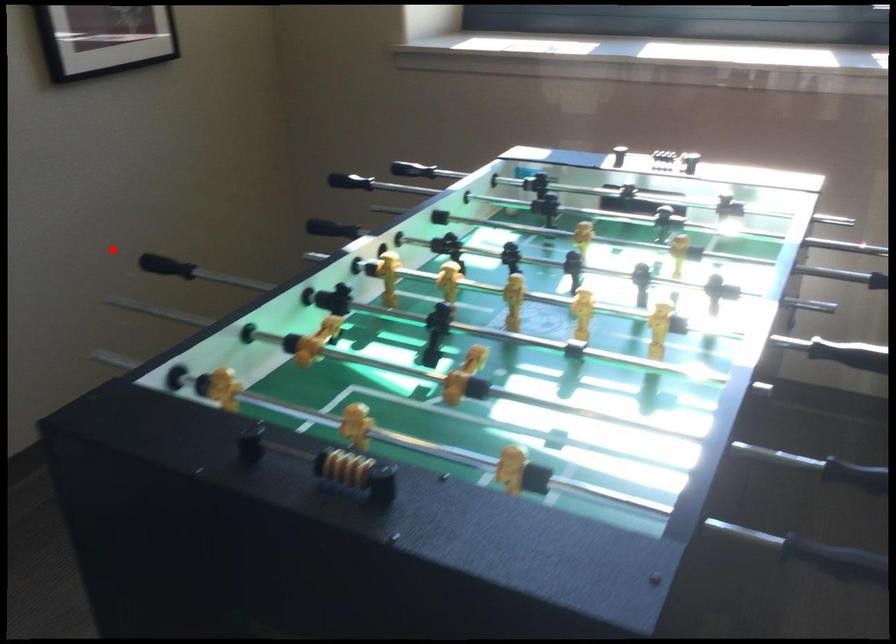
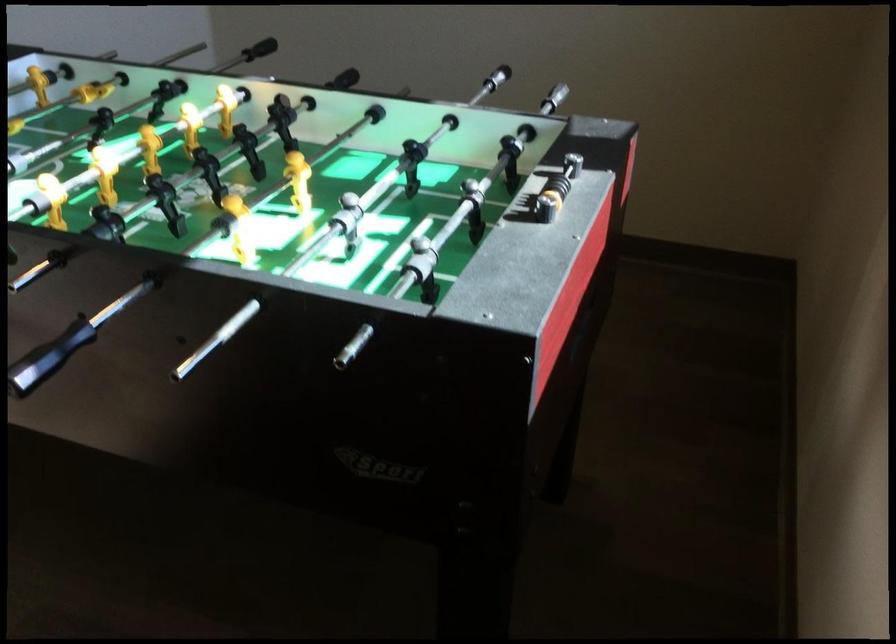
Locate, in the second image, the point that corresponds to the highlighted location in the first image.

(554, 98)